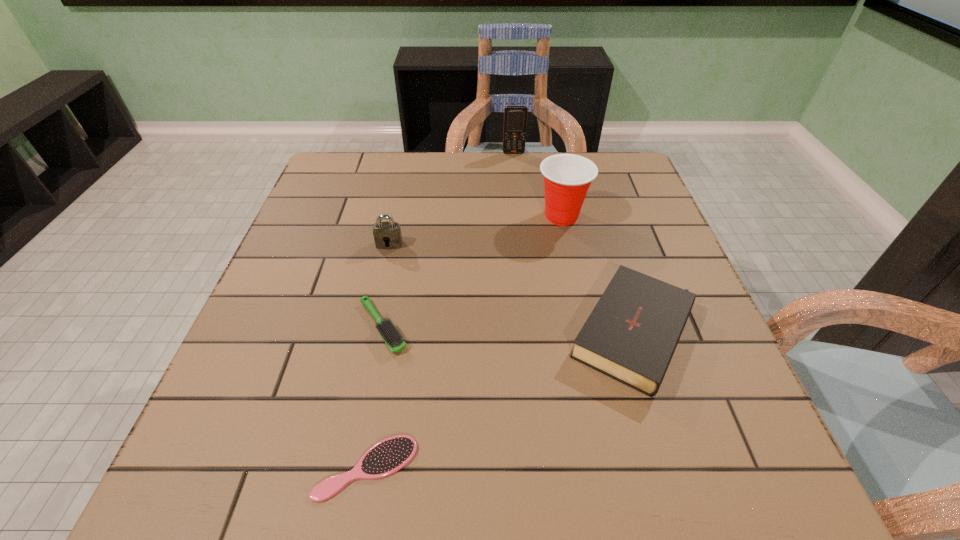
Find the location of `free point at the near edge`. free point at the near edge is located at coordinates click(x=600, y=475).

The image size is (960, 540). Identify the location of vacant space at the left edge of the desktop. (299, 347).

In the image, there is a desktop. Identify the location of vacant space at the right edge. (678, 369).

The height and width of the screenshot is (540, 960). Identify the location of vacant space at the far right corner. (612, 188).

This screenshot has width=960, height=540. I want to click on vacant space at the near right corner of the desktop, so click(681, 489).

The width and height of the screenshot is (960, 540). Identify the location of vacant space in between the third object from right to left and the farther hairbrush. (448, 240).

Locate an element on the screen. This screenshot has height=540, width=960. vacant area that lies between the second shortest object and the cup is located at coordinates coord(472,271).

I want to click on vacant point located between the shorter hairbrush and the second farthest object, so click(x=464, y=342).

The width and height of the screenshot is (960, 540). Identify the location of vacant space that's between the fourth tallest object and the fourth nearest object. (513, 289).

Locate an element on the screen. The width and height of the screenshot is (960, 540). vacant area that lies between the fourth tallest object and the cup is located at coordinates (599, 275).